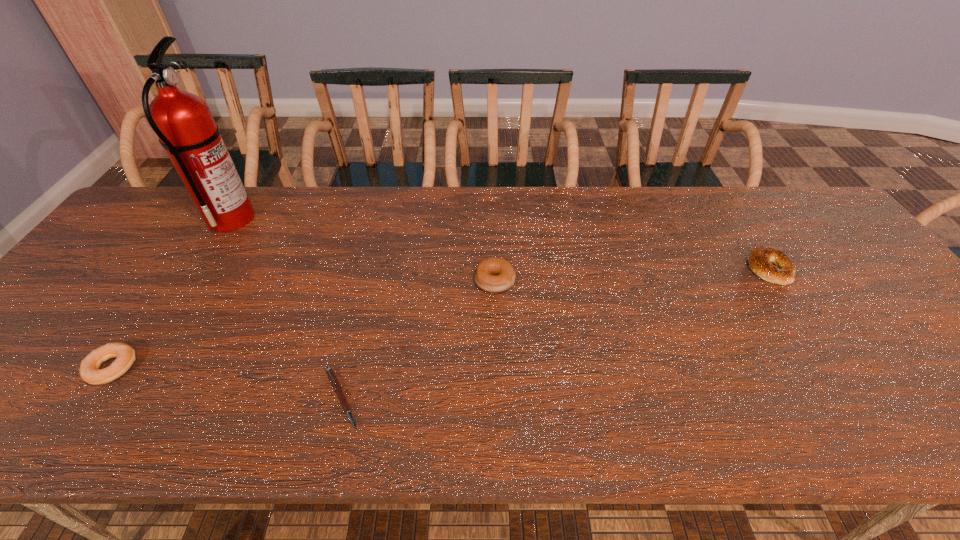
Find the location of a particular element. This screenshot has height=540, width=960. vacant space that satisfies the following two spatial constraints: 1. at the nozzle of the tallest object; 2. on the back side of the second bagel from right to left is located at coordinates (191, 282).